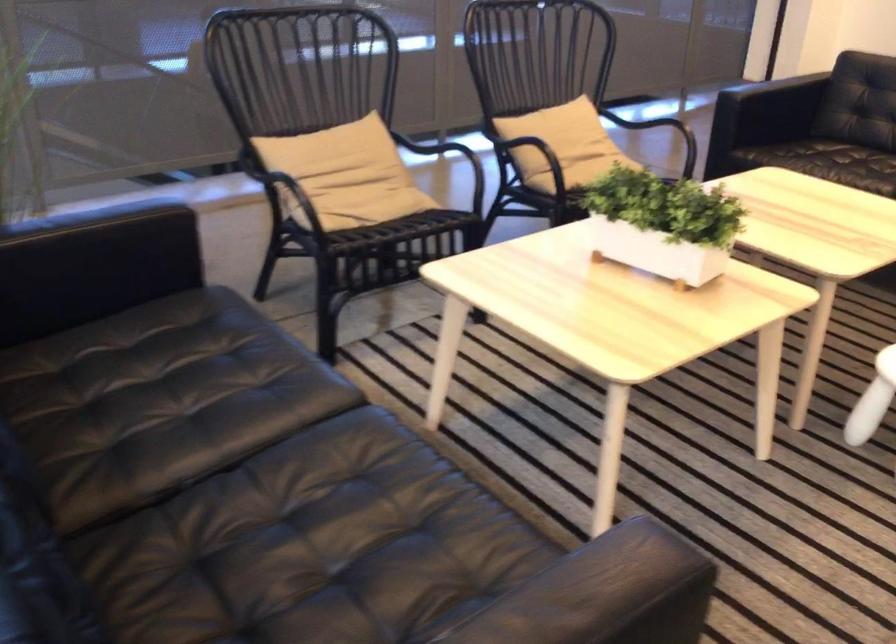
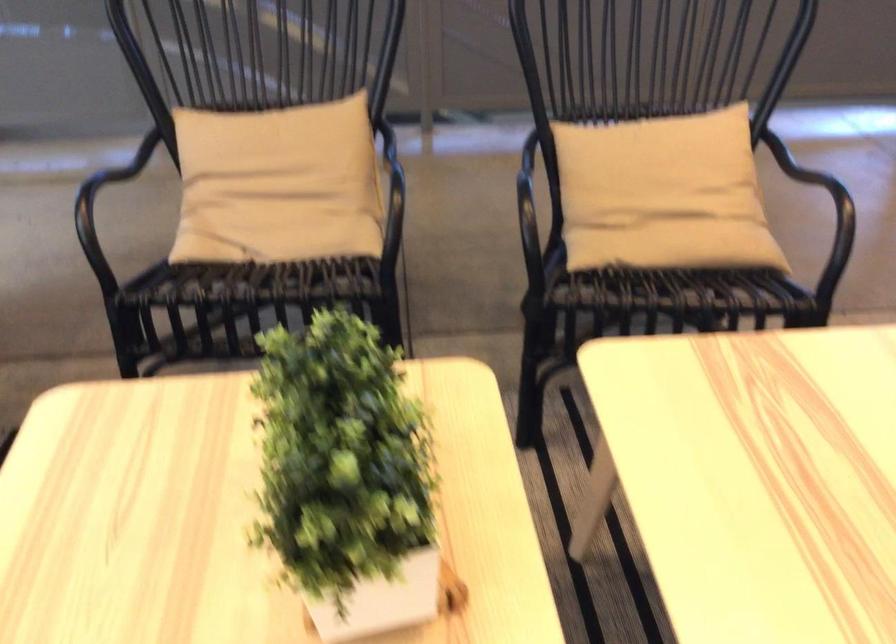
Find the pixel in the second image that matches point (593, 167) in the first image.

(674, 245)